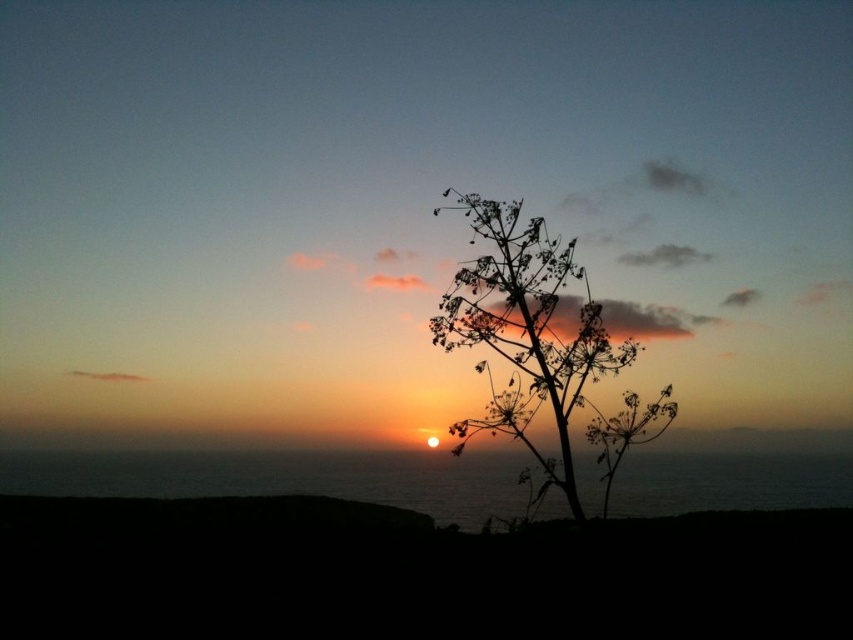
Between transparent water at lower center and silhouette wood at center, which one appears on the right side from the viewer's perspective?

silhouette wood at center is more to the right.

Between point (838, 477) and point (575, 337), which one is positioned in front?

Point (575, 337)

Image resolution: width=853 pixels, height=640 pixels. I want to click on transparent water at lower center, so pos(283,477).